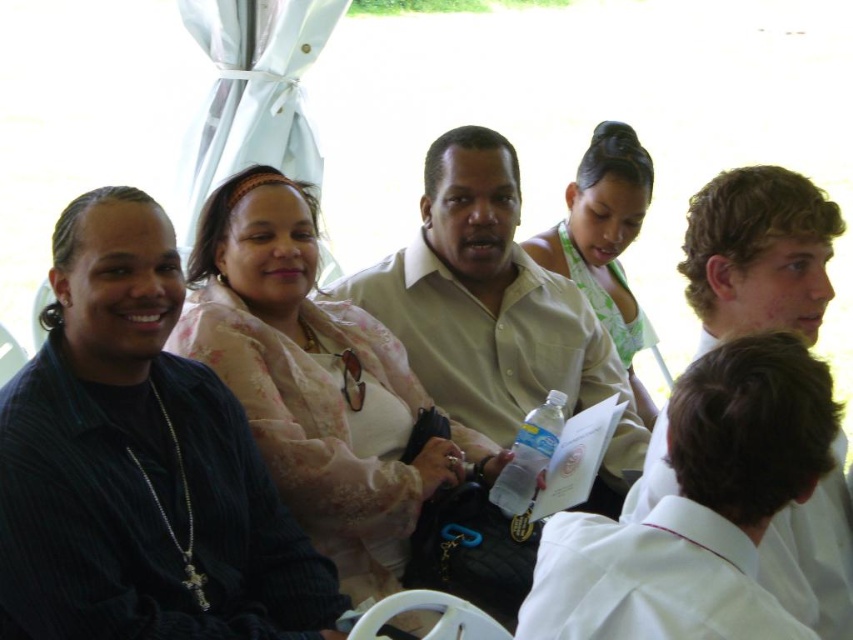
Is floral lace blouse at center below light beige shirt at center?

Yes.

Can you confirm if floral lace blouse at center is bigger than light beige shirt at center?

Actually, floral lace blouse at center might be smaller than light beige shirt at center.

Is point (448, 428) more distant than point (466, 234)?

No, it is in front of (466, 234).

At what (x,y) coordinates should I click in order to perform the action: click on floral lace blouse at center. Please return your answer as a coordinate pair (x, y). Looking at the image, I should click on (317, 381).

Which is more to the right, light beige shirt at center or green textured tank top at center?

green textured tank top at center is more to the right.

Does light beige shirt at center come in front of green textured tank top at center?

Yes.

Where is `light beige shirt at center`? This screenshot has height=640, width=853. light beige shirt at center is located at coordinates (494, 310).

Who is higher up, matte floral dress at upper left or light beige shirt at center?

light beige shirt at center

Describe the element at coordinates (138, 464) in the screenshot. The width and height of the screenshot is (853, 640). I see `matte floral dress at upper left` at that location.

The width and height of the screenshot is (853, 640). Describe the element at coordinates (138, 464) in the screenshot. I see `matte floral dress at upper left` at that location.

The height and width of the screenshot is (640, 853). What are the coordinates of `matte floral dress at upper left` in the screenshot? It's located at pyautogui.click(x=138, y=464).